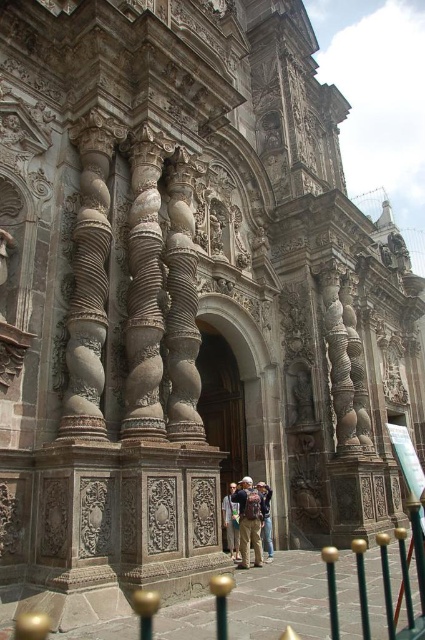
From the picture: You are standing in front of the ornate architectural structure and notice a light brown leather backpack at center and a light brown leather jacket at center. Which item is wider?

The light brown leather backpack at center might be wider than light brown leather jacket at center.

You are standing in front of the ornate architectural structure and notice a light brown leather backpack at center and khaki cotton pants at center. Which object is wider?

The light brown leather backpack at center might be wider than khaki cotton pants at center according to the description.

Looking at this image, you are standing in front of the ornate architectural structure and see a light brown leather backpack at center and khaki cotton pants at center. Which object is nearer to you?

The light brown leather backpack at center is closer to the viewer than the khaki cotton pants at center.